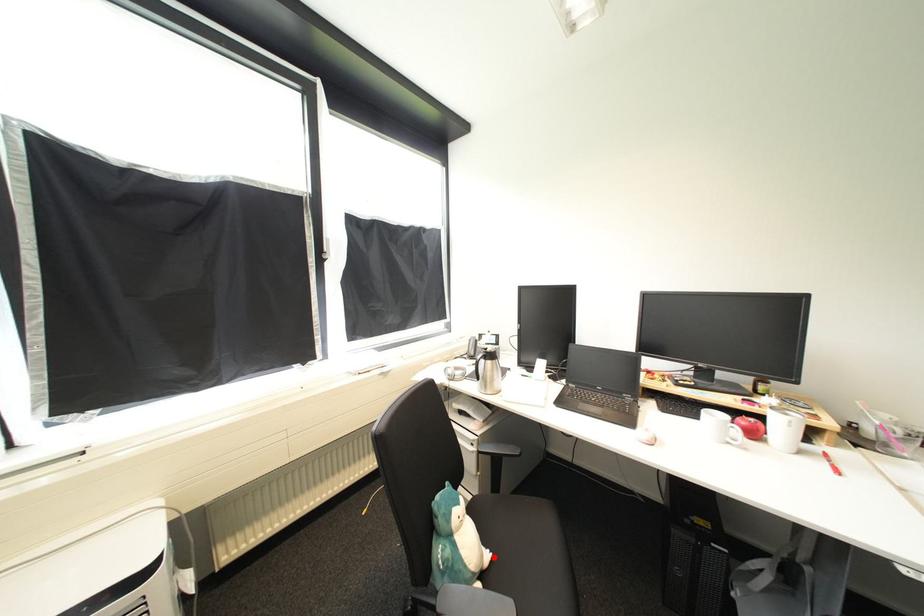
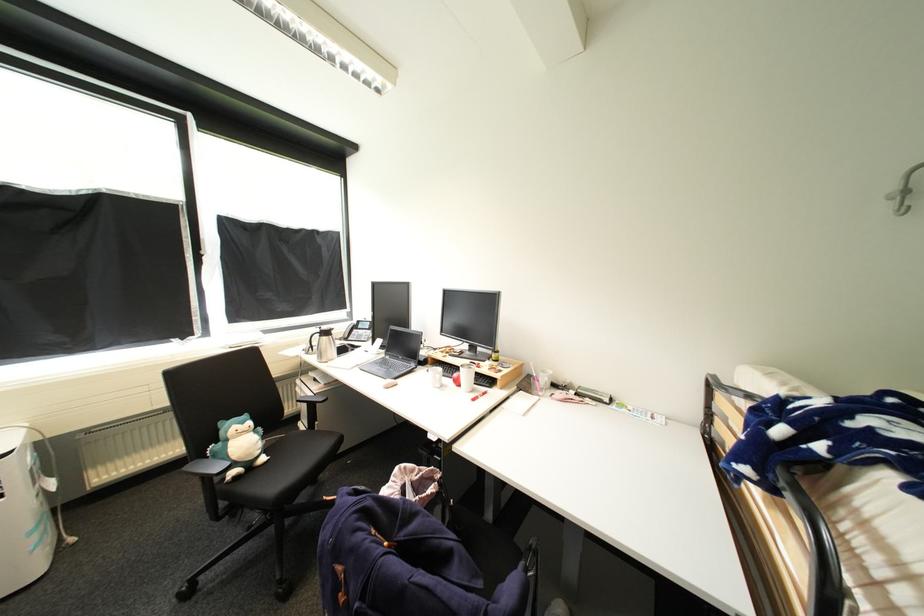
Where in the second image is the point corresponding to the highlighted location from the first image?

(270, 460)